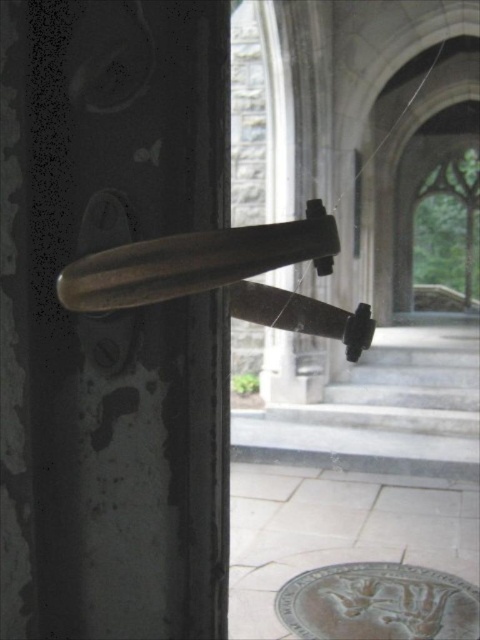
You are a locksmith assessing a door with two handles. The handles are labeled as the polished brass handle at left and the polished brass door handle at center. Which handle requires a larger key to operate?

The polished brass handle at left requires a larger key to operate because it is larger in size than the polished brass door handle at center.

Based on the photo, you are standing in front of the door and want to reach both the polished brass door handle at center and the bronze textured medallion at lower center. Which object will your hand touch first if you extend it towards them?

The polished brass door handle at center is closer to the viewer than the bronze textured medallion at lower center, so your hand will touch the polished brass door handle at center first.